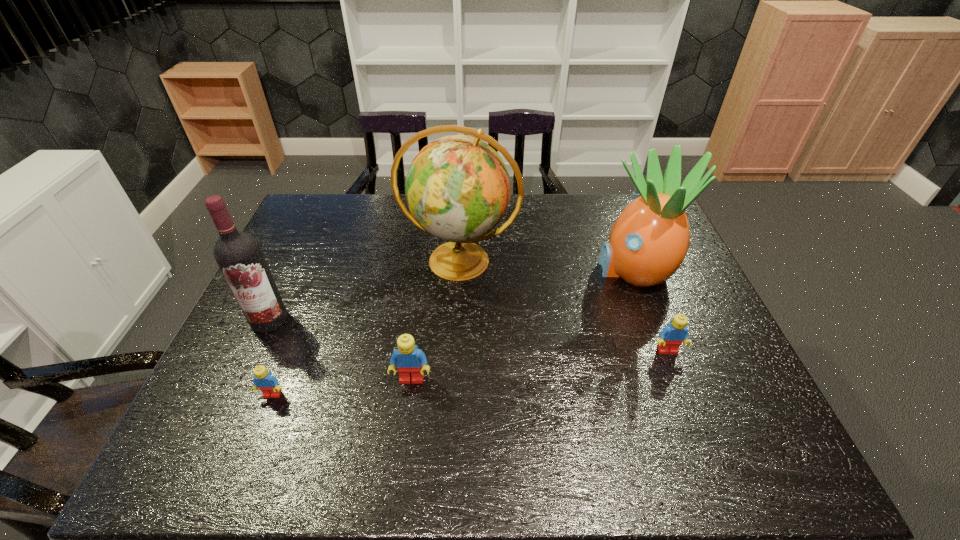
At what (x,y) coordinates should I click in order to perform the action: click on the nearest Lego. Please return your answer as a coordinate pair (x, y). This screenshot has height=540, width=960. Looking at the image, I should click on (266, 382).

Identify the location of the shortest Lego. (266, 382).

Where is `the second farthest Lego`? the second farthest Lego is located at coordinates (410, 361).

Locate an element on the screen. The height and width of the screenshot is (540, 960). the second Lego from left to right is located at coordinates (410, 361).

You are a GUI agent. You are given a task and a screenshot of the screen. Output one action in this format:
    pyautogui.click(x=<x>, y=<y>)
    Task: Click on the rightmost Lego
    
    Given the screenshot: What is the action you would take?
    pyautogui.click(x=671, y=337)

Where is `the fourth farthest object`? the fourth farthest object is located at coordinates (671, 337).

What are the coordinates of `the third farthest object` in the screenshot? It's located at (238, 254).

The image size is (960, 540). What are the coordinates of `the leftmost object` in the screenshot? It's located at (238, 254).

This screenshot has width=960, height=540. I want to click on globe, so click(458, 189).

This screenshot has width=960, height=540. Find the location of `pineapple`. pineapple is located at coordinates (648, 242).